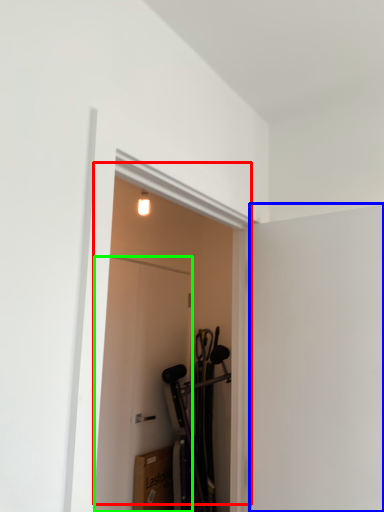
Question: Based on their relative distances, which object is farther from door (highlighted by a red box)? Choose from screen door (highlighted by a blue box) and door (highlighted by a green box).

Choices:
 (A) screen door
 (B) door

Answer: (A)